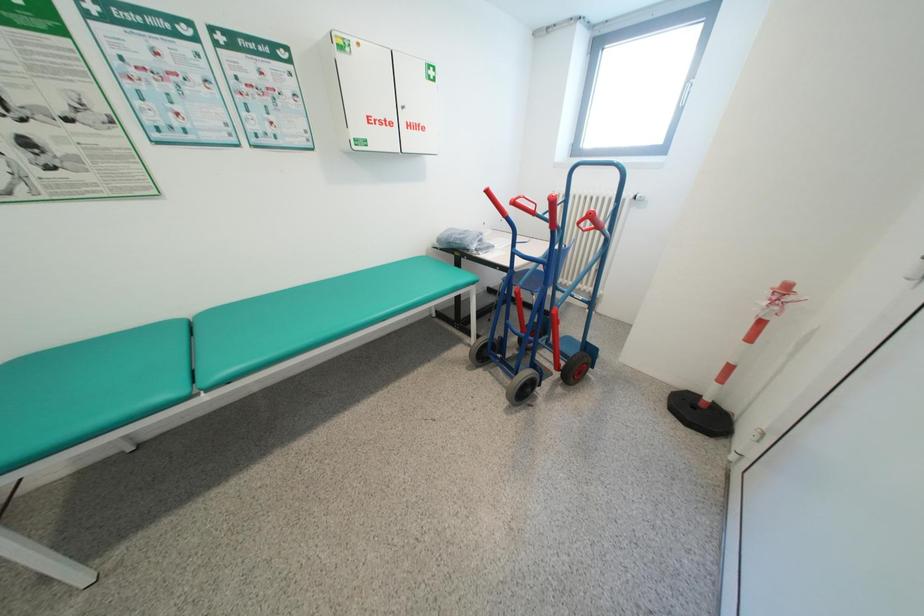
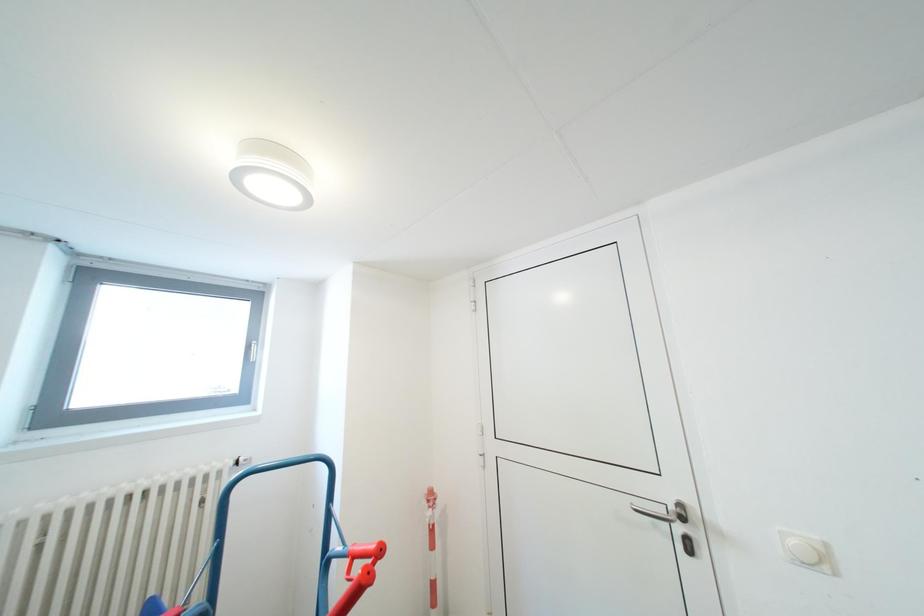
Question: The first image is from the beginning of the video and the second image is from the end. How did the camera likely rotate when shooting the video?

Choices:
 (A) Left
 (B) Right
 (C) Up
 (D) Down

Answer: (B)